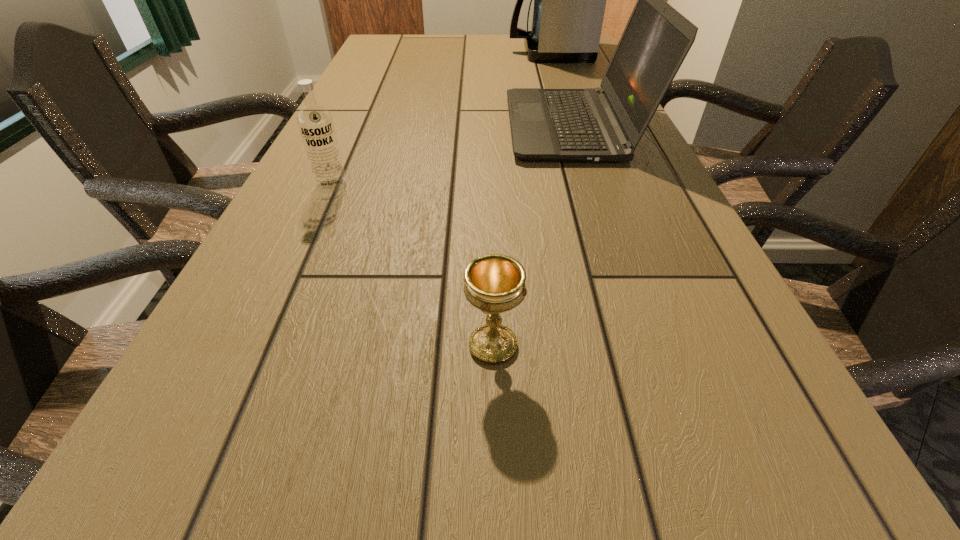
Where is `free location that satisfies the following two spatial constraints: 1. on the screen of the third shortest object; 2. on the front label of the vodka`? The image size is (960, 540). free location that satisfies the following two spatial constraints: 1. on the screen of the third shortest object; 2. on the front label of the vodka is located at coordinates (593, 186).

Locate an element on the screen. This screenshot has height=540, width=960. free space that satisfies the following two spatial constraints: 1. on the front panel of the coffee maker; 2. on the front label of the leftmost object is located at coordinates (595, 186).

Find the location of `vacant space that satisfies the following two spatial constraints: 1. on the screen of the third nearest object; 2. on the front label of the vodka`. vacant space that satisfies the following two spatial constraints: 1. on the screen of the third nearest object; 2. on the front label of the vodka is located at coordinates (593, 186).

Where is `free region that satisfies the following two spatial constraints: 1. on the screen of the second tallest object; 2. on the front label of the vodka`? free region that satisfies the following two spatial constraints: 1. on the screen of the second tallest object; 2. on the front label of the vodka is located at coordinates (593, 186).